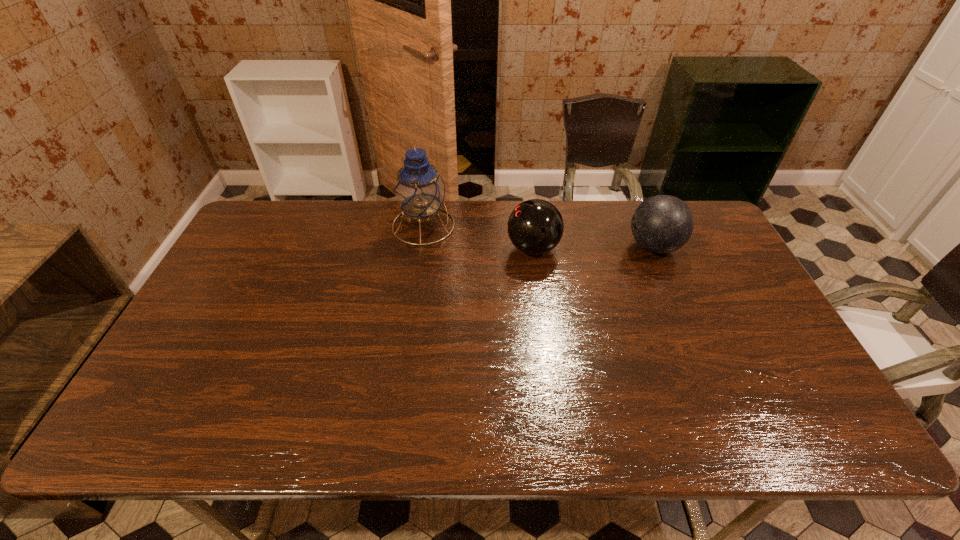
Find the location of a particular element. The width and height of the screenshot is (960, 540). free spot located 0.180m on the surface of the second object from left to right near the finger holes is located at coordinates (450, 248).

Where is `lantern that is positioned at the far edge`? The image size is (960, 540). lantern that is positioned at the far edge is located at coordinates (419, 190).

This screenshot has width=960, height=540. What are the coordinates of `object present at the right edge` in the screenshot? It's located at (661, 224).

Locate an element on the screen. The height and width of the screenshot is (540, 960). object that is at the far right corner is located at coordinates (661, 224).

You are a GUI agent. You are given a task and a screenshot of the screen. Output one action in this format:
    pyautogui.click(x=<x>, y=<y>)
    Task: Click on the vacant region at the far edge of the desktop
    The width and height of the screenshot is (960, 540).
    Given the screenshot: What is the action you would take?
    pyautogui.click(x=358, y=234)

At what (x,y) coordinates should I click in order to perform the action: click on free space at the near edge. Please return your answer as a coordinate pair (x, y). This screenshot has width=960, height=540. Looking at the image, I should click on coord(561,416).

Find the location of a particular element. vacant space at the left edge of the desktop is located at coordinates (218, 277).

Locate an element on the screen. This screenshot has height=540, width=960. vacant space at the right edge of the desktop is located at coordinates (720, 306).

The height and width of the screenshot is (540, 960). I want to click on vacant region between the left bowling ball and the tallest object, so click(x=478, y=237).

This screenshot has height=540, width=960. What are the coordinates of `free space between the left bowling ball and the rightmost object` in the screenshot? It's located at (593, 247).